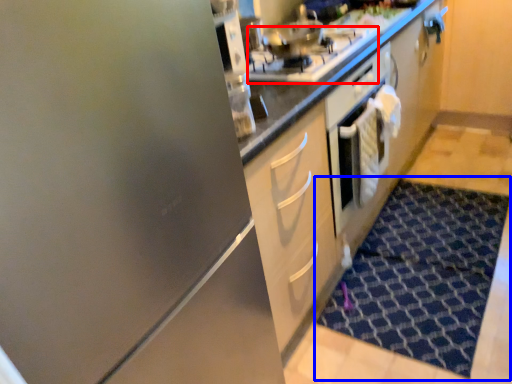
Question: Which point is further to the camera, gas stove (highlighted by a red box) or doormat (highlighted by a blue box)?

Choices:
 (A) gas stove
 (B) doormat

Answer: (B)